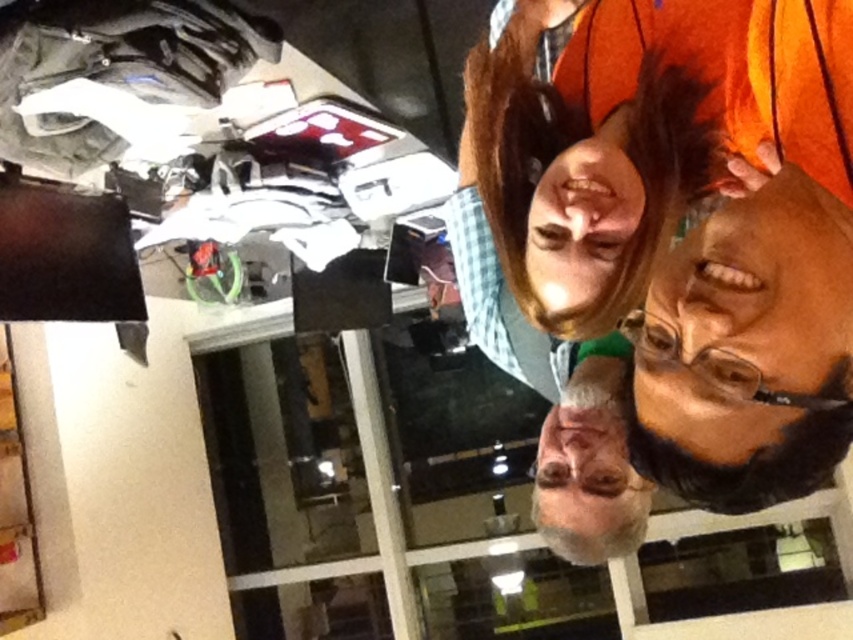
You are trying to locate the matte black glasses at lower right in the image. According to the coordinates provided, where exactly is it positioned?

The matte black glasses at lower right are positioned at coordinates point (749, 323).

In the scene shown: You are standing in a workshop and want to reach the point marked at coordinates point (842,216). If your arm can extend 28 inches, can you reach it without moving?

The distance between you and point (842,216) is 30.07 inches, which is beyond your arm extension of 28 inches. You cannot reach it without moving.